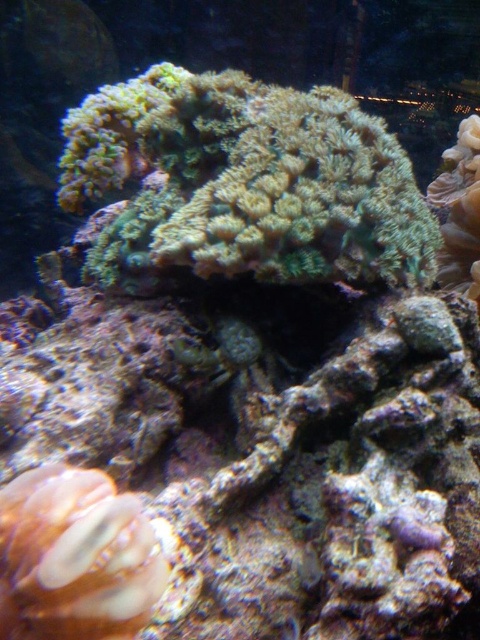
You are a scuba diver with a 1.5 meter long measuring tape. You want to measure the distance between yourself and the green textured coral at center. Can you reach the coral with your tape measure?

The green textured coral at center and viewer are 1.08 meters apart, so yes, the diver can reach the coral with a 1.5 meter tape measure since the distance is shorter than the tape length.

You are a small fish in the underwater scene. You want to swim from the translucent orange coral at lower left to the green textured coral at center. Which direction should you swim to reach the taller coral?

The green textured coral at center is much taller than the translucent orange coral at lower left, so you should swim towards the center to reach the taller coral.

You are an underwater photographer aiming to capture a wide shot of the green textured coral at center and the translucent orange coral at lower left. Based on their sizes, which coral should you focus on to ensure it fits entirely within your camera frame?

The green textured coral at center might be wider than translucent orange coral at lower left, so focusing on the green textured coral at center would ensure it fits within the frame since it is the wider of the two.